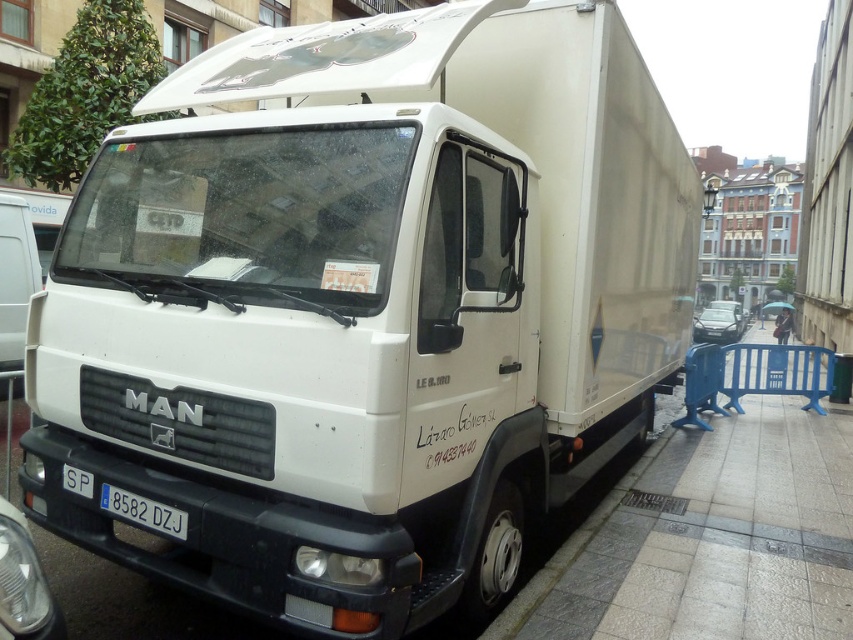
Which is more to the right, gray concrete curb at lower right or white plastic license plate at lower center?

Positioned to the right is gray concrete curb at lower right.

Is gray concrete curb at lower right positioned behind white plastic license plate at lower center?

That is True.

Describe the element at coordinates (583, 529) in the screenshot. I see `gray concrete curb at lower right` at that location.

I want to click on gray concrete curb at lower right, so click(583, 529).

Is white matte van at left shorter than white plastic license plate at lower center?

No.

Can you confirm if white matte van at left is positioned to the left of white plastic license plate at lower center?

Yes, white matte van at left is to the left of white plastic license plate at lower center.

Find the location of a particular element. The width and height of the screenshot is (853, 640). white matte van at left is located at coordinates (15, 276).

Locate an element on the screen. Image resolution: width=853 pixels, height=640 pixels. white matte van at left is located at coordinates (15, 276).

Between point (21, 262) and point (563, 544), which one is positioned behind?

Positioned behind is point (21, 262).

Is white matte van at left to the right of gray concrete curb at lower right from the viewer's perspective?

Incorrect, white matte van at left is not on the right side of gray concrete curb at lower right.

Does point (35, 250) come closer to viewer compared to point (682, 406)?

Yes.

Locate an element on the screen. white matte van at left is located at coordinates (15, 276).